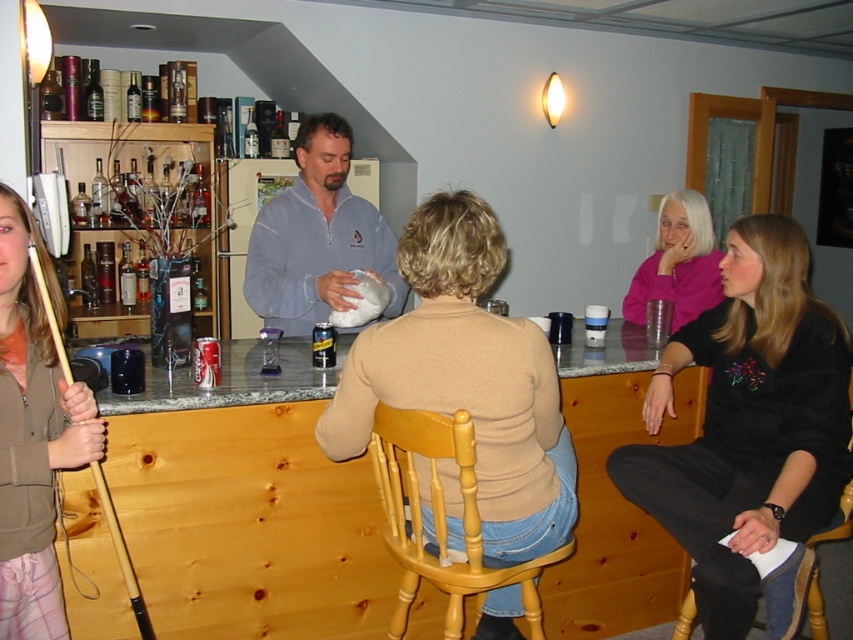
Question: Does matte blue sweater at center have a larger size compared to pink matte sweater at upper right?

Choices:
 (A) yes
 (B) no

Answer: (A)

Question: Is beige sweater at center to the left of matte blue sweater at center from the viewer's perspective?

Choices:
 (A) no
 (B) yes

Answer: (A)

Question: Is the position of black velvet sweater at upper right more distant than that of matte blue sweater at center?

Choices:
 (A) yes
 (B) no

Answer: (B)

Question: Estimate the real-world distances between objects in this image. Which object is farther from the beige sweater at center?

Choices:
 (A) matte blue sweater at center
 (B) brown plaid pajama pants at lower left
 (C) black velvet sweater at upper right
 (D) pink matte sweater at upper right

Answer: (D)

Question: Which object is farther from the camera taking this photo?

Choices:
 (A) black velvet sweater at upper right
 (B) beige sweater at center
 (C) matte blue sweater at center

Answer: (C)

Question: Which object appears farthest from the camera in this image?

Choices:
 (A) matte blue sweater at center
 (B) black velvet sweater at upper right

Answer: (A)